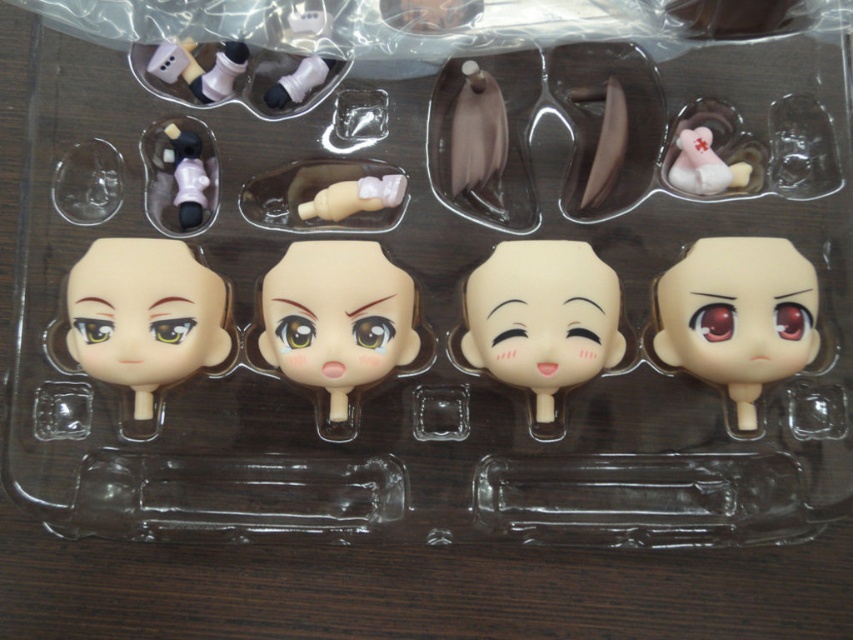
Which is behind, point (544, 272) or point (734, 241)?

Positioned behind is point (544, 272).

Locate an element on the screen. The height and width of the screenshot is (640, 853). smooth beige face at center is located at coordinates (543, 321).

Which of these two, smooth beige doll head at center or matte pink plastic doll at upper left, stands shorter?

matte pink plastic doll at upper left is shorter.

Consider the image. Is smooth beige doll head at center wider than matte pink plastic doll at upper left?

Yes.

Does point (316, 280) lie in front of point (183, 221)?

Yes, point (316, 280) is closer to viewer.

Where is `smooth beige doll head at center`? smooth beige doll head at center is located at coordinates (337, 323).

Consider the image. Between matte plastic doll head at left and smooth beige doll head at center, which one appears on the right side from the viewer's perspective?

smooth beige doll head at center

Is matte plastic doll head at left thinner than smooth beige doll head at center?

Yes.

Where is `matte plastic doll head at left`? The image size is (853, 640). matte plastic doll head at left is located at coordinates (144, 321).